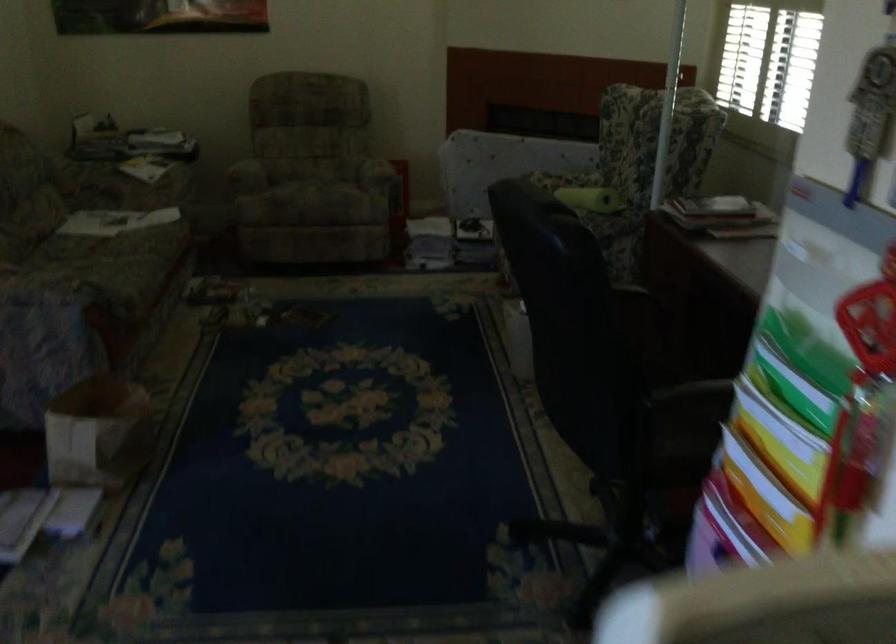
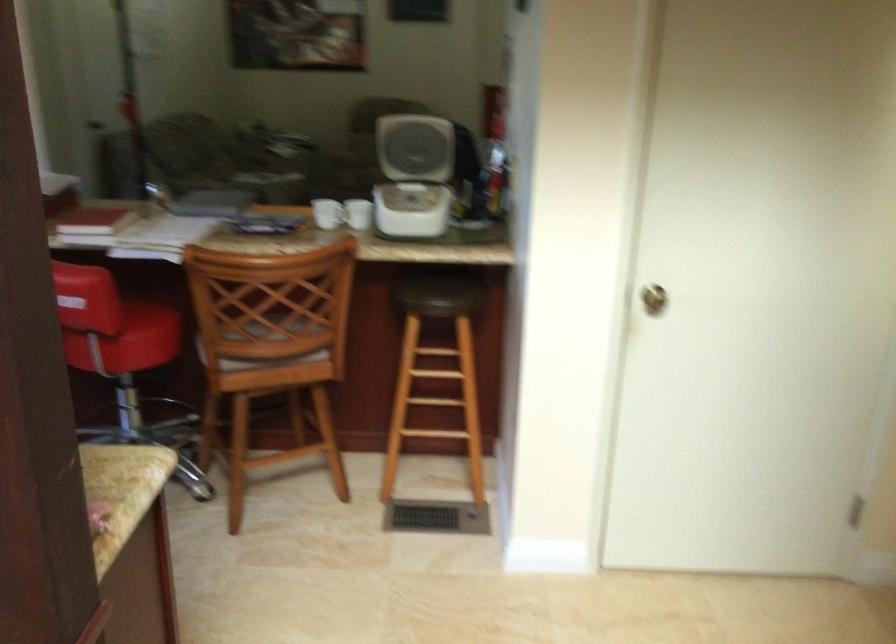
In the second image, find the point that corresponds to point 767,556 in the first image.

(416, 137)